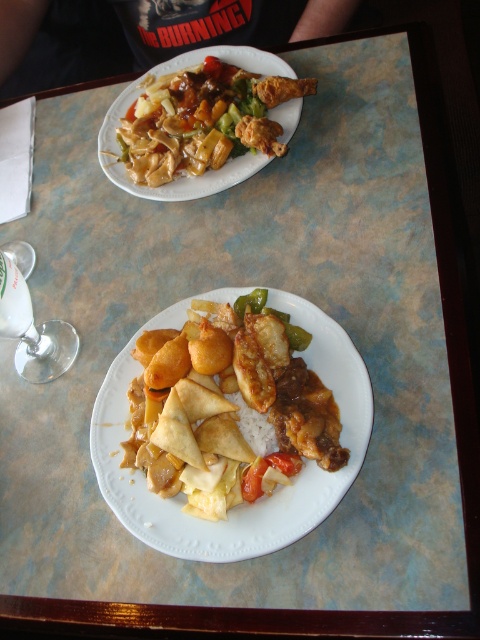
Question: Which point appears closest to the camera in this image?

Choices:
 (A) (137, 502)
 (B) (248, 173)
 (C) (242, 419)
 (D) (68, 346)

Answer: (C)

Question: Which object is farther from the camera taking this photo?

Choices:
 (A) shiny brown chicken at upper left
 (B) green glossy bell pepper at center
 (C) clear glass wine glass at lower left

Answer: (A)

Question: Does white matte plate at center lie behind green glossy bell pepper at center?

Choices:
 (A) yes
 (B) no

Answer: (B)

Question: Can you confirm if white matte rice at center is positioned to the right of green glossy bell pepper at center?

Choices:
 (A) yes
 (B) no

Answer: (B)

Question: Is shiny brown chicken at upper left behind clear glass wine glass at lower left?

Choices:
 (A) yes
 (B) no

Answer: (A)

Question: Which point is farther from the camera taking this photo?

Choices:
 (A) (256, 312)
 (B) (251, 408)
 (C) (250, 96)
 (D) (24, 360)

Answer: (C)